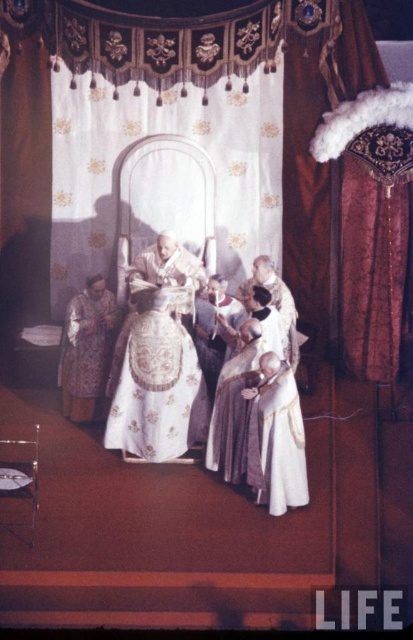
Question: Can you confirm if white satin robe at center is positioned below silky purple robe at lower left?

Choices:
 (A) yes
 (B) no

Answer: (A)

Question: Among these objects, which one is nearest to the camera?

Choices:
 (A) white embroidered robe at center
 (B) silky purple robe at lower left
 (C) white satin robe at center

Answer: (C)

Question: Where is white embroidered robe at center located in relation to silky purple robe at lower left in the image?

Choices:
 (A) below
 (B) above

Answer: (A)

Question: Among these points, which one is farthest from the camera?

Choices:
 (A) (90, 378)
 (B) (166, 326)

Answer: (A)

Question: Which object appears closest to the camera in this image?

Choices:
 (A) white satin robe at center
 (B) white embroidered robe at center

Answer: (A)

Question: Is white embroidered robe at center closer to the viewer compared to white satin robe at center?

Choices:
 (A) yes
 (B) no

Answer: (B)